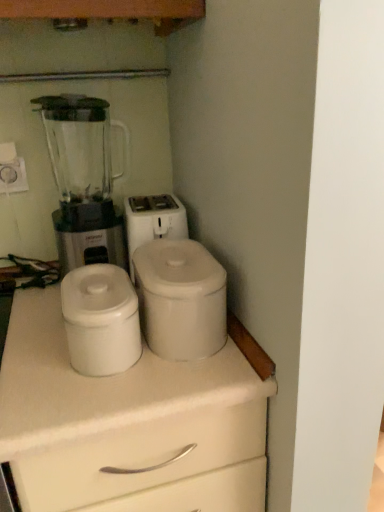
You are a GUI agent. You are given a task and a screenshot of the screen. Output one action in this format:
    pyautogui.click(x=<x>, y=<y>)
    Task: Click on the vacant space situated on the left part of white matte container at center, which is the second appliance from right to left
    This screenshot has width=384, height=512.
    Given the screenshot: What is the action you would take?
    pyautogui.click(x=34, y=343)